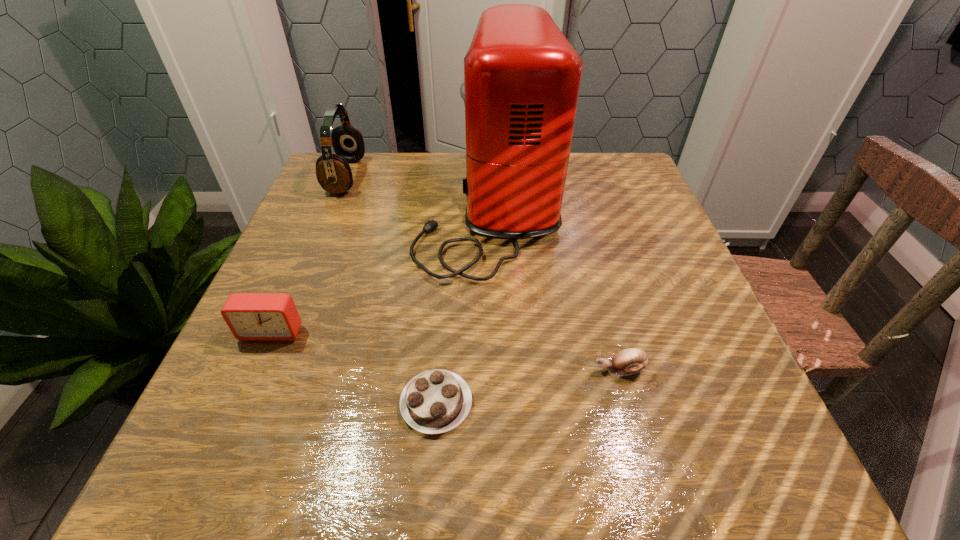
Locate an element on the screen. This screenshot has height=540, width=960. object at the far left corner is located at coordinates (333, 172).

The image size is (960, 540). In order to click on vacant space at the far edge of the desktop in this screenshot , I will do `click(448, 155)`.

The height and width of the screenshot is (540, 960). In the image, there is a desktop. In order to click on vacant space at the near edge in this screenshot , I will do `click(644, 451)`.

This screenshot has width=960, height=540. In the image, there is a desktop. What are the coordinates of `vacant space at the left edge` in the screenshot? It's located at click(358, 203).

In the image, there is a desktop. Where is `free space at the right edge`? free space at the right edge is located at coordinates (636, 278).

In the image, there is a desktop. Identify the location of free space at the far left corner. (368, 160).

This screenshot has height=540, width=960. In order to click on unoccupied position between the escargot and the tallest object in this screenshot , I will do `click(555, 289)`.

Where is `free area in between the kitchen mixer and the fourth shortest object`? The image size is (960, 540). free area in between the kitchen mixer and the fourth shortest object is located at coordinates (418, 192).

At what (x,y) coordinates should I click in order to perform the action: click on empty space that is in between the fourth shortest object and the second shortest object. Please return your answer as a coordinate pair (x, y). This screenshot has height=540, width=960. Looking at the image, I should click on (483, 273).

This screenshot has height=540, width=960. Identify the location of free area in between the tallest object and the shortest object. (463, 306).